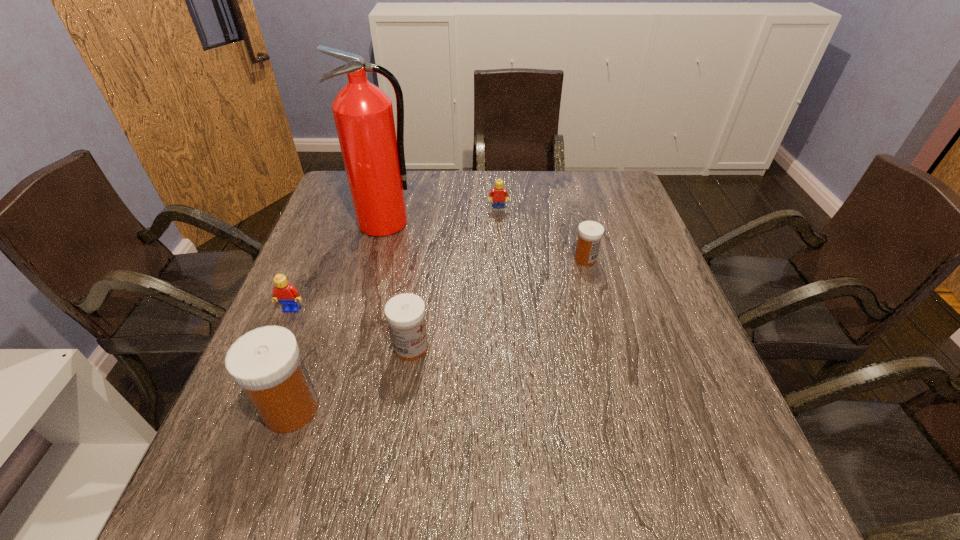
In order to click on vacant space at the far right corner in this screenshot , I will do `click(591, 177)`.

At what (x,y) coordinates should I click in order to perform the action: click on empty space that is in between the fire extinguisher and the third farthest object. Please return your answer as a coordinate pair (x, y). The image size is (960, 540). Looking at the image, I should click on (485, 241).

Find the location of a particular element. The height and width of the screenshot is (540, 960). free spot between the tallest object and the nearest medicine is located at coordinates (338, 316).

This screenshot has height=540, width=960. Identify the location of empty location between the left Lego and the fire extinguisher. (339, 266).

Find the location of a particular element. This screenshot has height=540, width=960. unoccupied area between the tallest object and the fourth shortest object is located at coordinates point(398,285).

Where is `free point between the nearest medicine and the second medicine from left to right`? free point between the nearest medicine and the second medicine from left to right is located at coordinates (351, 378).

Locate an element on the screen. Image resolution: width=960 pixels, height=540 pixels. blank region between the fire extinguisher and the left Lego is located at coordinates (339, 266).

The height and width of the screenshot is (540, 960). I want to click on vacant space that is in between the rightmost medicine and the second farthest medicine, so click(498, 303).

At what (x,y) coordinates should I click in order to perform the action: click on vacant area that lies between the nearest medicine and the tallest object. Please return your answer as a coordinate pair (x, y). This screenshot has width=960, height=540. Looking at the image, I should click on (338, 316).

Identify the location of object that ranks as the closest to the farther Lego. tap(374, 160).